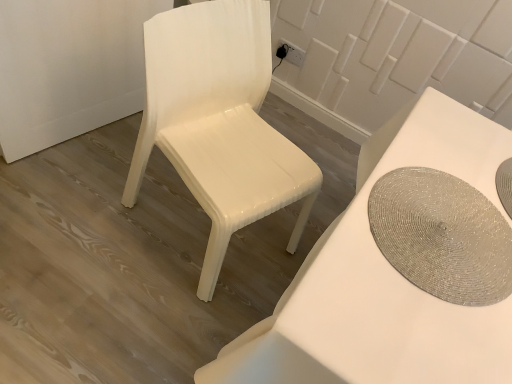
Find the location of `vacant area that is in front of shiny silver placemat at right`. vacant area that is in front of shiny silver placemat at right is located at coordinates (401, 326).